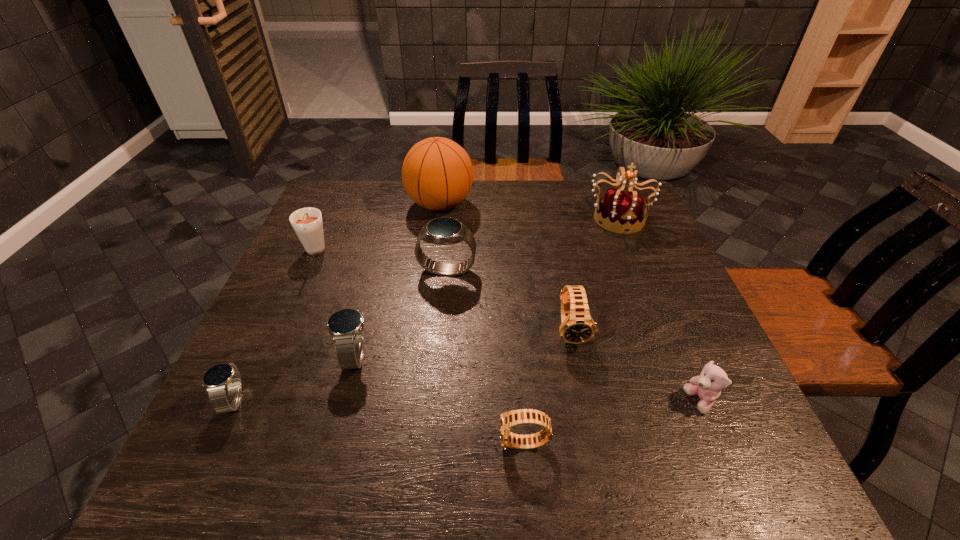
You are a GUI agent. You are given a task and a screenshot of the screen. Output one action in this format:
    pyautogui.click(x=<x>, y=<y>)
    Task: Click on the object that is at the near edge
    
    Given the screenshot: What is the action you would take?
    pyautogui.click(x=510, y=419)

Where is `root beer situated at the left edge`? root beer situated at the left edge is located at coordinates (307, 223).

Locate an element on the screen. watch that is at the left edge is located at coordinates (216, 379).

Where is `tiara that is at the right edge`? tiara that is at the right edge is located at coordinates (622, 211).

Find the location of a particular element. teddy bear that is positioned at the right edge is located at coordinates (708, 385).

This screenshot has width=960, height=540. What are the coordinates of `object located at the far right corner` in the screenshot? It's located at 622,211.

The height and width of the screenshot is (540, 960). I want to click on free space at the far edge of the desktop, so click(480, 193).

This screenshot has width=960, height=540. In order to click on vacant space at the near edge of the desktop in this screenshot , I will do `click(282, 482)`.

Where is `vacant space at the left edge of the desktop`? The image size is (960, 540). vacant space at the left edge of the desktop is located at coordinates (226, 415).

This screenshot has width=960, height=540. Identify the location of free point at the right edge. (660, 349).